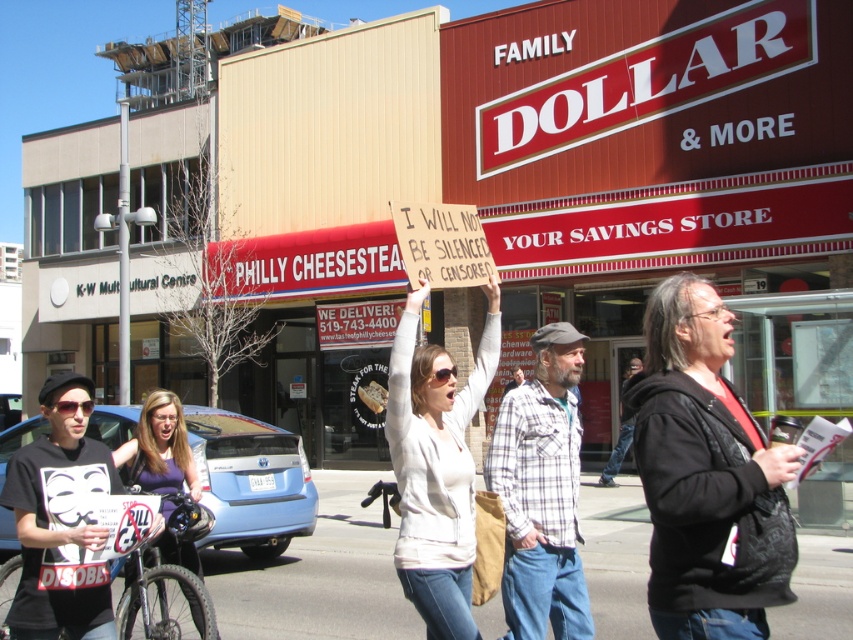
Question: Which of the following is the closest to the observer?

Choices:
 (A) (720, 410)
 (B) (448, 362)
 (C) (158, 438)

Answer: (A)

Question: Can you confirm if black leather jacket at center is thinner than purple fabric shirt at lower left?

Choices:
 (A) no
 (B) yes

Answer: (B)

Question: Among these points, which one is nearest to the camera?

Choices:
 (A) (444, 380)
 (B) (192, 490)
 (C) (726, 611)

Answer: (C)

Question: Is black leather jacket at center to the right of purple fabric shirt at lower left from the viewer's perspective?

Choices:
 (A) yes
 (B) no

Answer: (A)

Question: Which point is farther to the camera?

Choices:
 (A) (163, 419)
 (B) (766, 508)
 (C) (405, 538)

Answer: (A)

Question: Is black leather jacket at center above white cotton shirt at center?

Choices:
 (A) no
 (B) yes

Answer: (B)